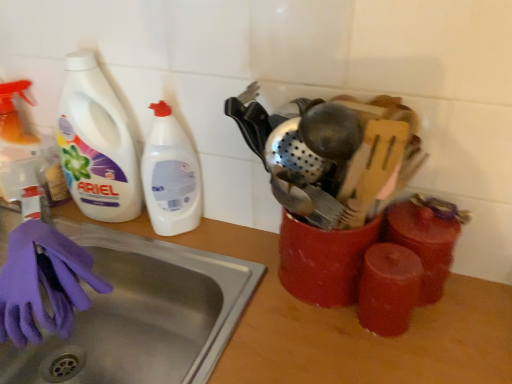
What are the coordinates of `free space above wooden counter top at center (from a real-world perspective)` in the screenshot? It's located at (223, 275).